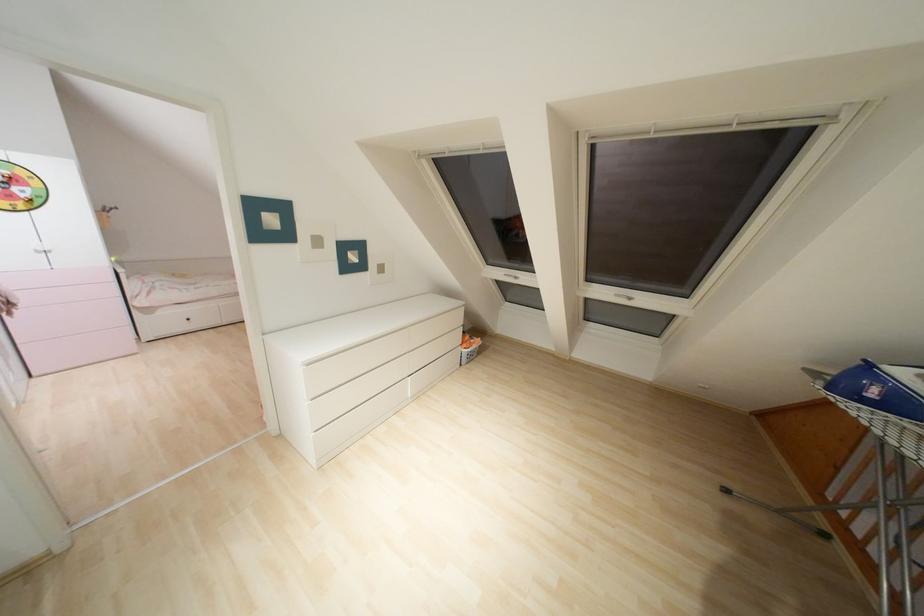
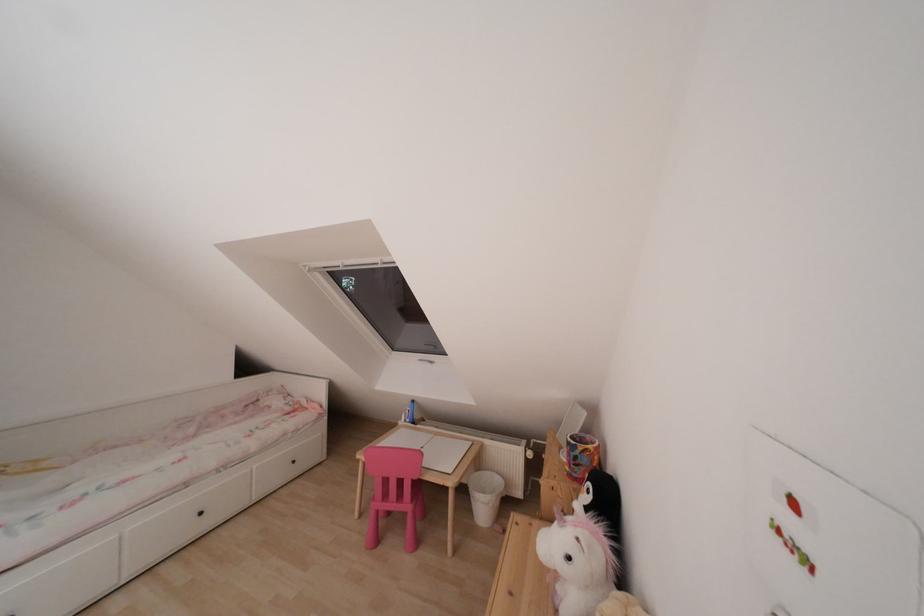
What movement of the cameraman would produce the second image?

The cameraman moved toward left, forward.